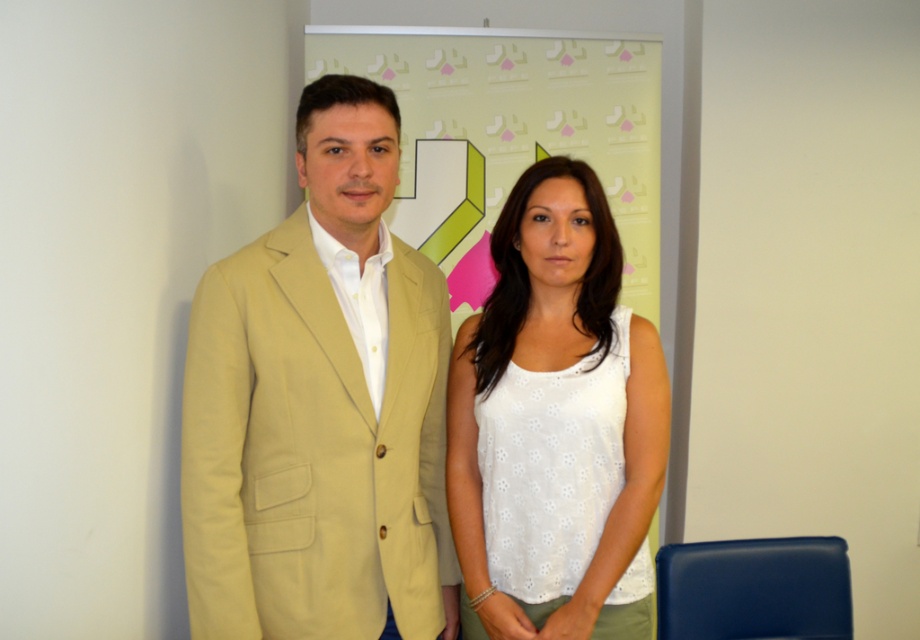
Can you confirm if beige fabric suit at center is shorter than light green fabric banner at center?

In fact, beige fabric suit at center may be taller than light green fabric banner at center.

Which is below, beige fabric suit at center or light green fabric banner at center?

beige fabric suit at center is below.

Does point (349, 252) come in front of point (414, 177)?

Yes.

Locate an element on the screen. The height and width of the screenshot is (640, 920). beige fabric suit at center is located at coordinates (320, 404).

Which of these two, beige fabric suit at center or white dotted tank top at center, stands shorter?

white dotted tank top at center is shorter.

Who is taller, beige fabric suit at center or white dotted tank top at center?

beige fabric suit at center is taller.

Who is more distant from viewer, (306, 106) or (596, 188)?

The point (596, 188) is behind.

Find the location of a particular element. This screenshot has width=920, height=640. beige fabric suit at center is located at coordinates (320, 404).

Is white dotted tank top at center in front of light green fabric banner at center?

Yes.

Describe the element at coordinates (555, 426) in the screenshot. I see `white dotted tank top at center` at that location.

This screenshot has width=920, height=640. What are the coordinates of `white dotted tank top at center` in the screenshot? It's located at (555, 426).